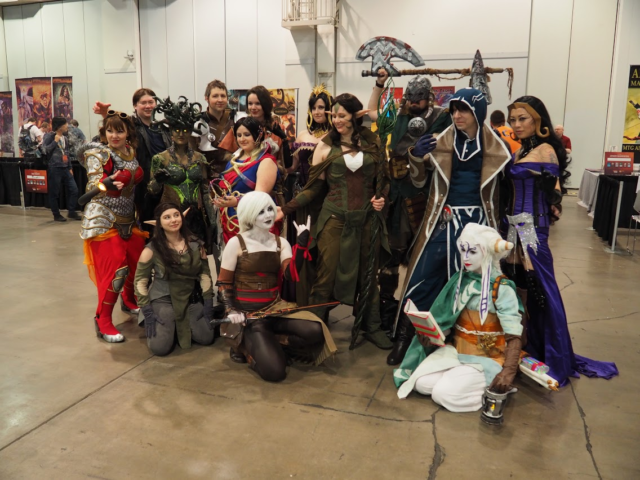
The height and width of the screenshot is (480, 640). Find the location of `floor`. floor is located at coordinates (66, 293), (621, 347).